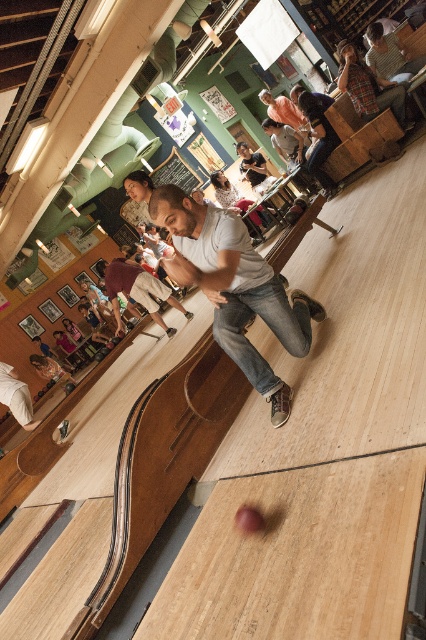
Between white matte shirt at center and white cotton shirt at lower left, which one is positioned lower?

white cotton shirt at lower left

Does white matte shirt at center have a larger size compared to white cotton shirt at lower left?

Correct, white matte shirt at center is larger in size than white cotton shirt at lower left.

The width and height of the screenshot is (426, 640). Identify the location of white matte shirt at center. (235, 288).

The width and height of the screenshot is (426, 640). In order to click on white matte shirt at center in this screenshot , I will do `click(235, 288)`.

Is point (221, 314) positioned behind point (135, 269)?

No.

Which is above, white matte shirt at center or maroon cotton shirt at center?

maroon cotton shirt at center

Which is behind, point (307, 339) or point (111, 282)?

Positioned behind is point (111, 282).

This screenshot has width=426, height=640. In order to click on white matte shirt at center in this screenshot , I will do `click(235, 288)`.

Is maroon cotton shirt at center further to camera compared to white cotton shirt at lower left?

Yes, it is.

Looking at this image, who is shorter, maroon cotton shirt at center or white cotton shirt at lower left?

white cotton shirt at lower left is shorter.

What do you see at coordinates (137, 289) in the screenshot? I see `maroon cotton shirt at center` at bounding box center [137, 289].

In order to click on maroon cotton shirt at center in this screenshot , I will do `click(137, 289)`.